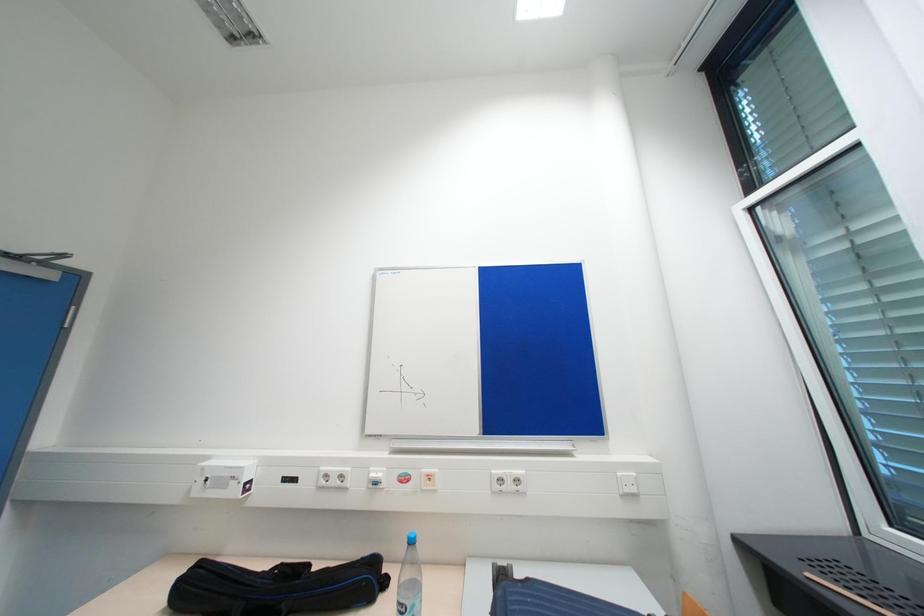
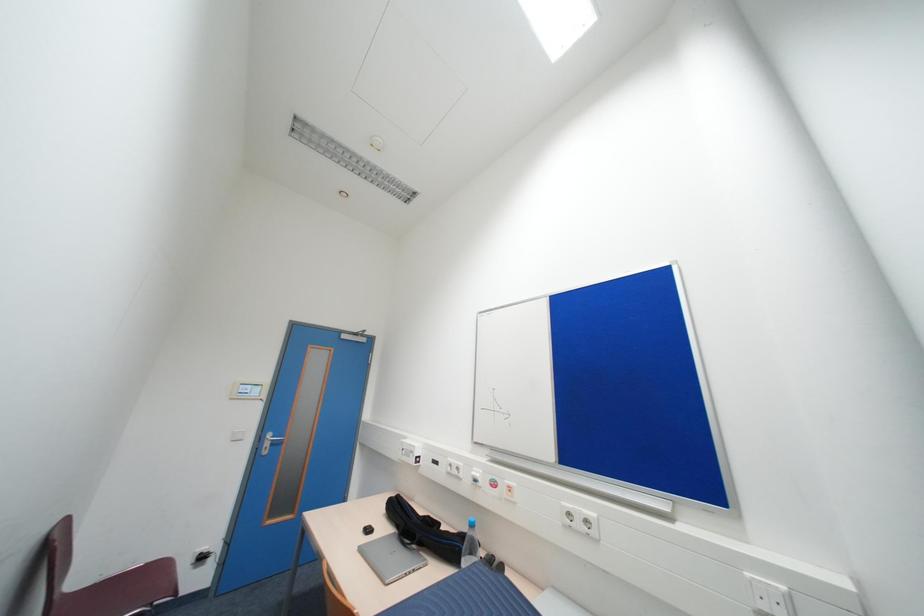
Question: The first image is from the beginning of the video and the second image is from the end. How did the camera likely rotate when shooting the video?

Choices:
 (A) Left
 (B) Right
 (C) Up
 (D) Down

Answer: (A)